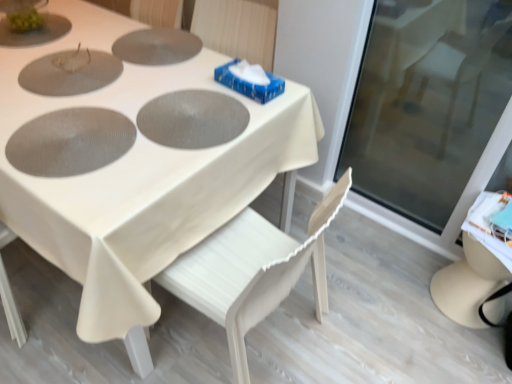
The image size is (512, 384). In order to click on vacant space in front of transparent glass door at right in this screenshot , I will do `click(402, 302)`.